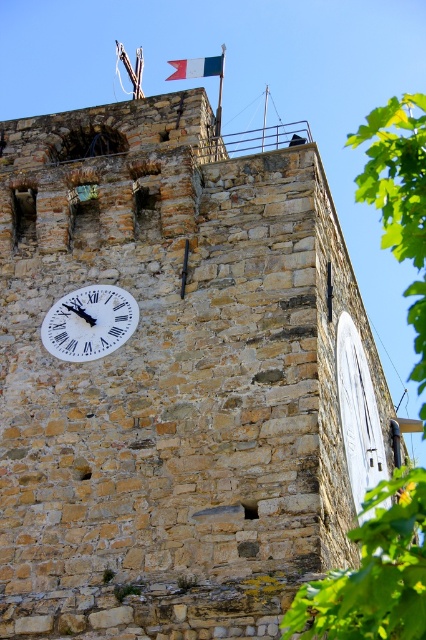
Between white matte clock at center-left and white fabric flag at top center, which one has more height?

white fabric flag at top center

Is white matte clock at center-left wider than white fabric flag at top center?

In fact, white matte clock at center-left might be narrower than white fabric flag at top center.

Between point (124, 298) and point (209, 65), which one is positioned in front?

Point (124, 298) is in front.

Locate an element on the screen. The width and height of the screenshot is (426, 640). white matte clock at center-left is located at coordinates (89, 323).

Between green leafy tree at right and white matte clock at center-left, which one has more height?

green leafy tree at right is taller.

Which is above, green leafy tree at right or white matte clock at center-left?

green leafy tree at right is higher up.

I want to click on green leafy tree at right, so click(400, 196).

Who is taller, green leafy tree at right or white fabric flag at top center?

green leafy tree at right is taller.

Is green leafy tree at right to the left of white fabric flag at top center from the viewer's perspective?

No, green leafy tree at right is not to the left of white fabric flag at top center.

Describe the element at coordinates (400, 196) in the screenshot. This screenshot has height=640, width=426. I see `green leafy tree at right` at that location.

The image size is (426, 640). I want to click on green leafy tree at right, so click(400, 196).